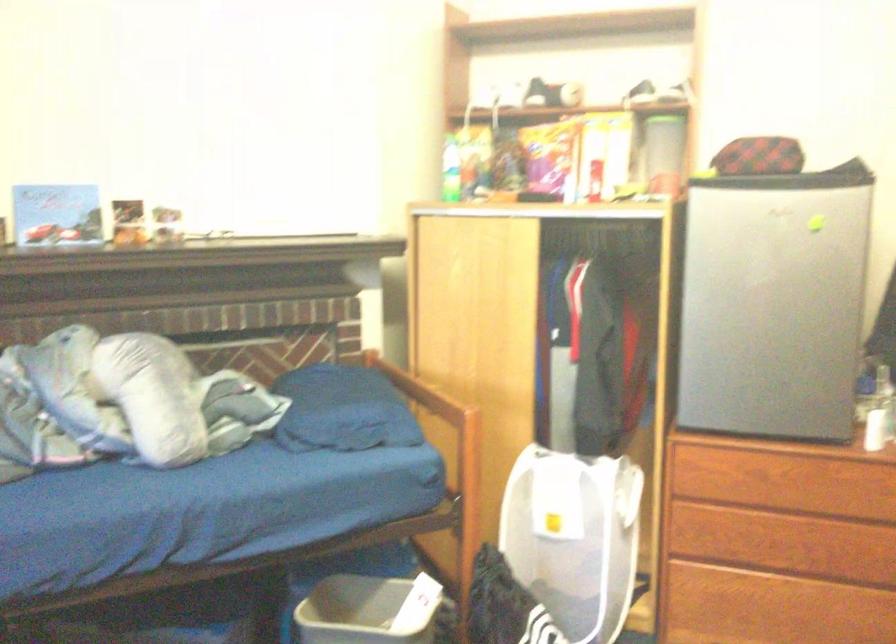
Find where to slid the wardrobe sliding door. Please return your answer as a coordinate pair (x, y).

(502, 323)